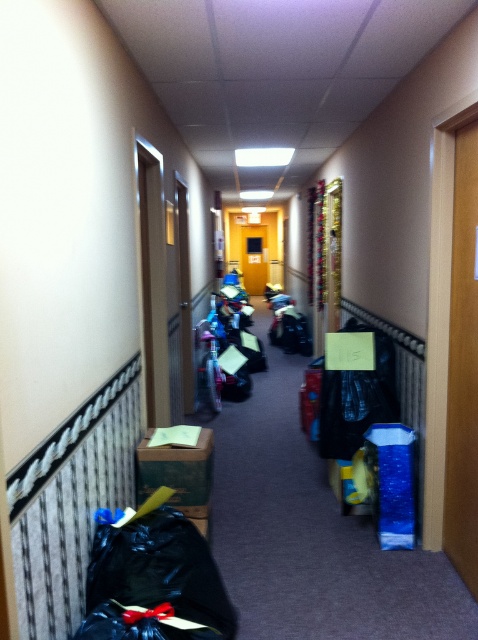
Question: Which point is farther to the camera?

Choices:
 (A) (163, 563)
 (B) (142, 496)

Answer: (B)

Question: Is black plastic bag at lower left smaller than green cardboard box at lower center?

Choices:
 (A) no
 (B) yes

Answer: (A)

Question: Among these objects, which one is nearest to the camera?

Choices:
 (A) black plastic bag at lower left
 (B) green cardboard box at lower center

Answer: (A)

Question: Which of the following is the farthest from the observer?

Choices:
 (A) (173, 499)
 (B) (184, 582)

Answer: (A)

Question: Is black plastic bag at lower left above green cardboard box at lower center?

Choices:
 (A) yes
 (B) no

Answer: (B)

Question: Is black plastic bag at lower left positioned at the back of green cardboard box at lower center?

Choices:
 (A) yes
 (B) no

Answer: (B)